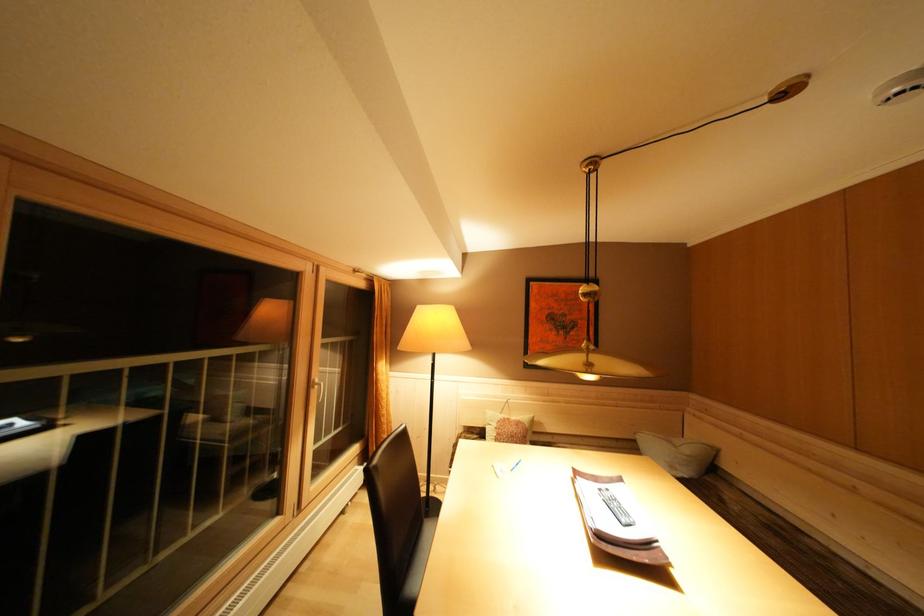
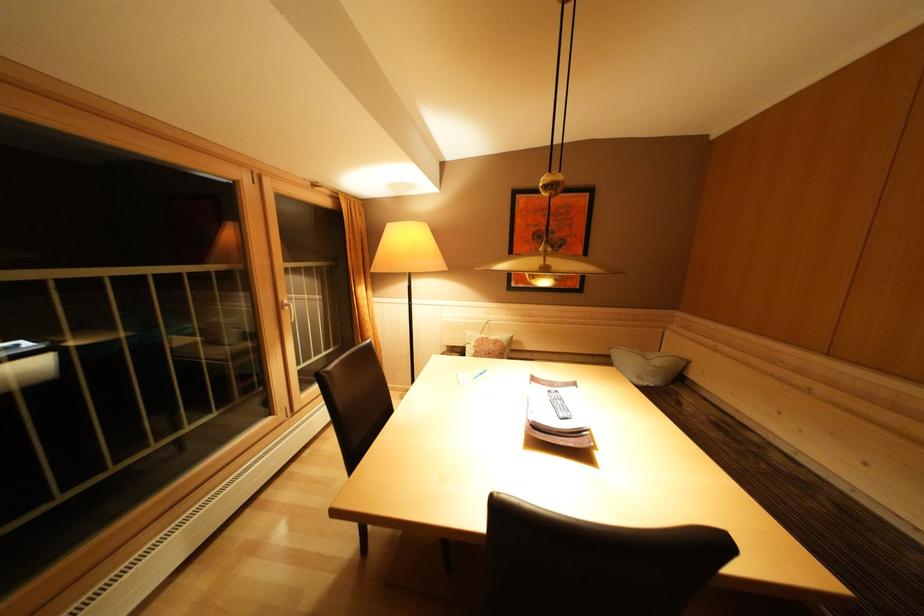
Question: What movement of the cameraman would produce the second image?

Choices:
 (A) Left
 (B) Right
 (C) Forward
 (D) Backward

Answer: (B)